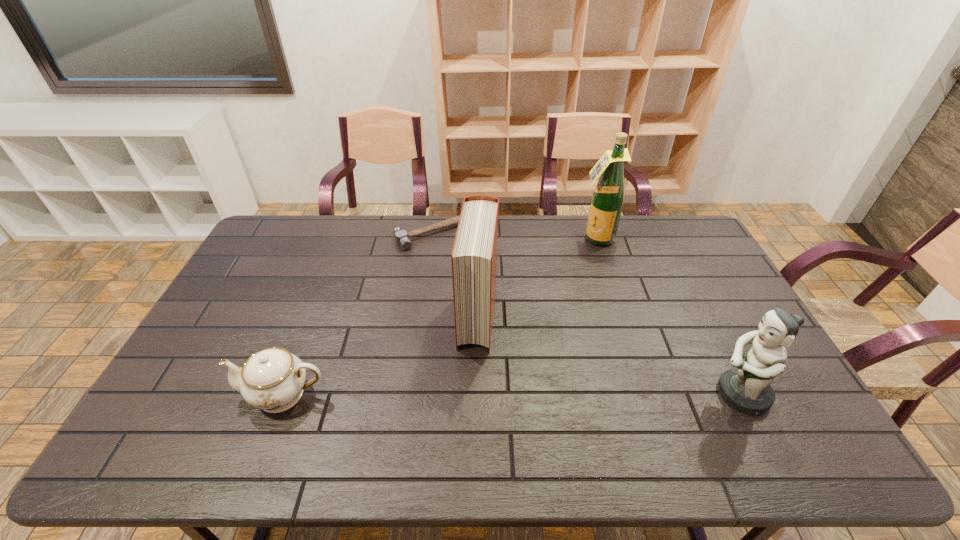
Identify the location of the fourth tallest object. This screenshot has height=540, width=960. (273, 379).

The width and height of the screenshot is (960, 540). What are the coordinates of `chinaware` in the screenshot? It's located at (273, 379).

You are a GUI agent. You are given a task and a screenshot of the screen. Output one action in this format:
    pyautogui.click(x=<x>, y=<y>)
    Task: Click on the figurine
    The width and height of the screenshot is (960, 540).
    Given the screenshot: What is the action you would take?
    pyautogui.click(x=747, y=388)

This screenshot has width=960, height=540. What are the coordinates of `the third tallest object` in the screenshot? It's located at (747, 388).

Where is `the shortest object`? The height and width of the screenshot is (540, 960). the shortest object is located at coordinates (401, 236).

The height and width of the screenshot is (540, 960). Find the location of `the second object from right to left`. the second object from right to left is located at coordinates (607, 201).

The width and height of the screenshot is (960, 540). I want to click on the third farthest object, so click(474, 255).

What are the coordinates of `the second tallest object` in the screenshot? It's located at (474, 255).

The width and height of the screenshot is (960, 540). I want to click on vacant area located 0.170m at the spout of the fourth tallest object, so click(174, 394).

I want to click on vacant space located at the spout of the fourth tallest object, so click(x=212, y=394).